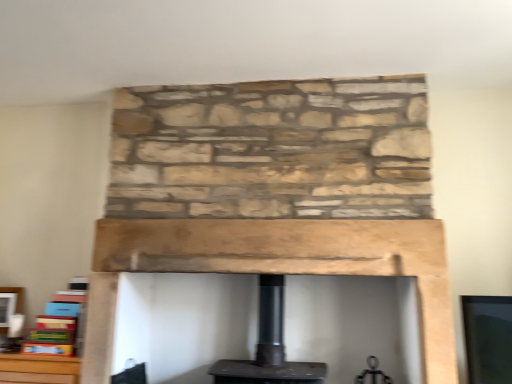
Find the location of a particular element. Image resolution: width=512 pixels, height=384 pixels. blank space above smooth wood mantle at center (from a real-world perspective) is located at coordinates (243, 221).